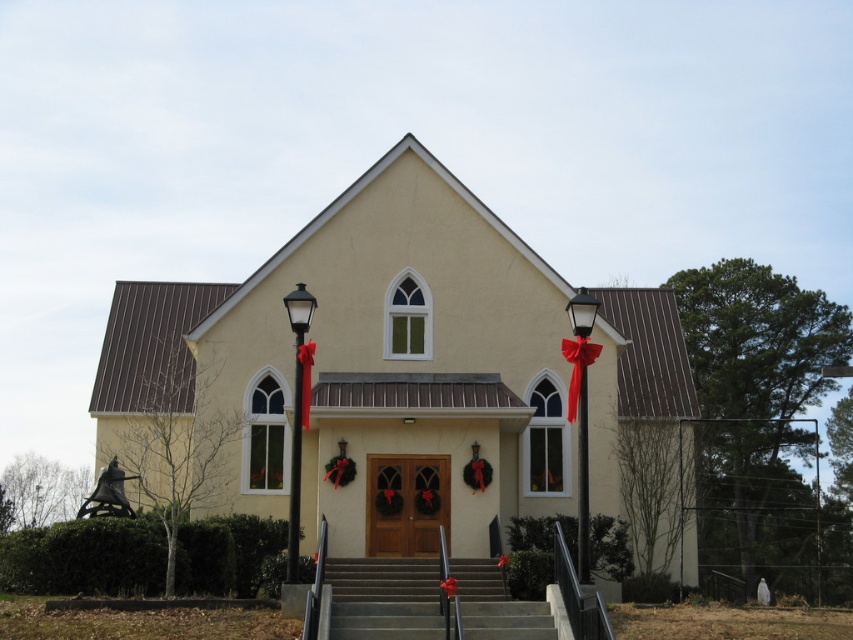
Question: Which point is farther to the camera?

Choices:
 (A) smooth concrete stairs at center
 (B) yellow matte church at center

Answer: (B)

Question: Which of the following is the farthest from the observer?

Choices:
 (A) yellow matte church at center
 (B) smooth concrete stairs at center

Answer: (A)

Question: Can you confirm if yellow matte church at center is positioned above smooth concrete stairs at center?

Choices:
 (A) yes
 (B) no

Answer: (A)

Question: Is the position of yellow matte church at center more distant than that of smooth concrete stairs at center?

Choices:
 (A) no
 (B) yes

Answer: (B)

Question: Does yellow matte church at center appear under smooth concrete stairs at center?

Choices:
 (A) no
 (B) yes

Answer: (A)

Question: Which of the following is the closest to the observer?

Choices:
 (A) tap(341, 548)
 (B) tap(360, 568)

Answer: (B)